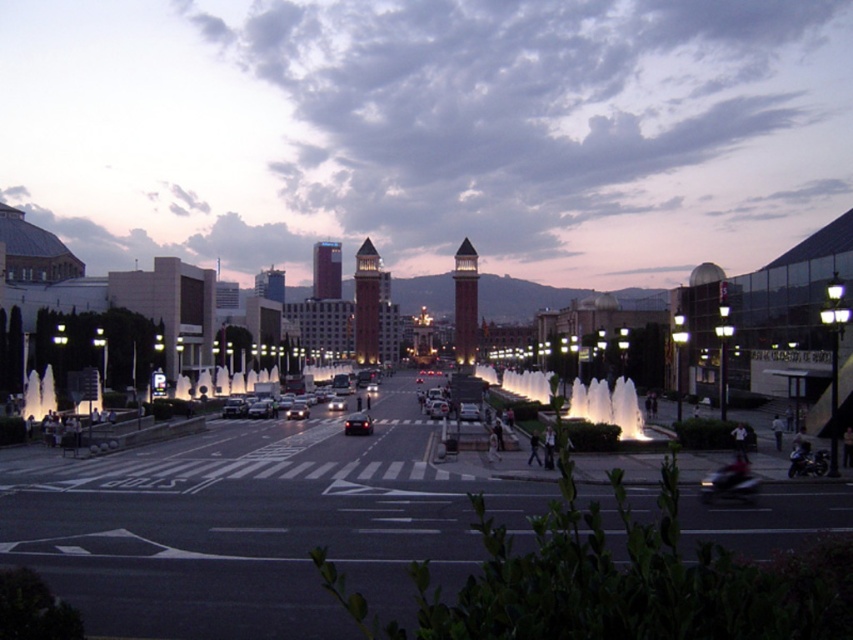
You are a tourist standing on the sidewalk near the road. You want to take a photo that includes both the brown brick bell tower at center and the shiny silver sedan at center. Which object should you position closer to the edge of the frame to ensure both are fully visible?

Since the brown brick bell tower at center is larger than the shiny silver sedan at center, you should position the brown brick bell tower at center closer to the edge of the frame to ensure both objects fit within the photo.

Looking at this image, you are a city planner assessing the space between the illuminated stone fountain at center and the matte brick tower at center. Given that the minimum required distance for a new pedestrian walkway is 150 meters, can the walkway be constructed between them?

The distance between the illuminated stone fountain at center and the matte brick tower at center is 143.79 meters, which is less than the required 150 meters. Therefore, the walkway cannot be constructed between them.